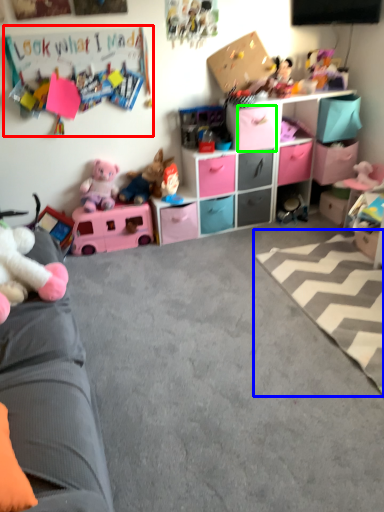
Question: Estimate the real-world distances between objects in this image. Which object is closer to bulletin board (highlighted by a red box), plain (highlighted by a blue box) or drawer (highlighted by a green box)?

Choices:
 (A) plain
 (B) drawer

Answer: (B)